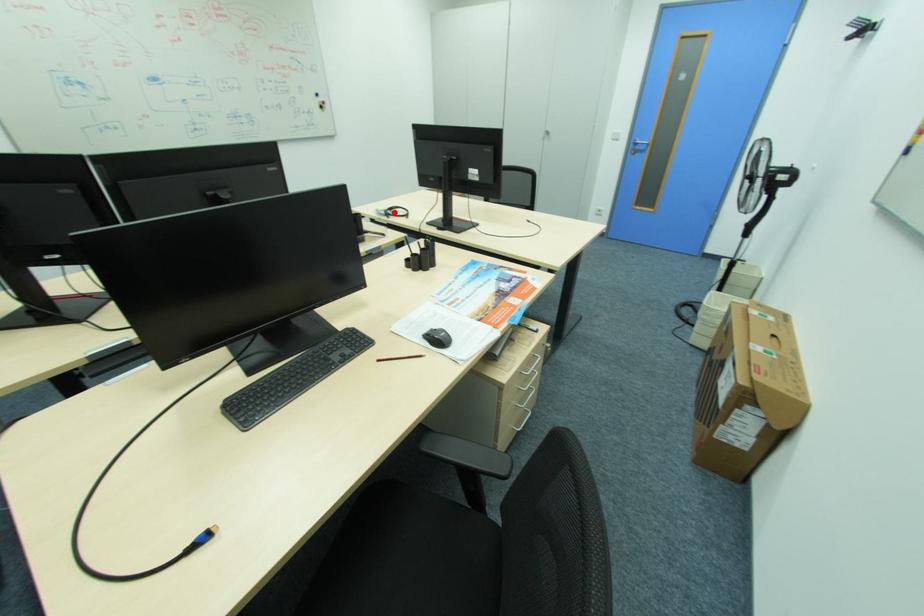
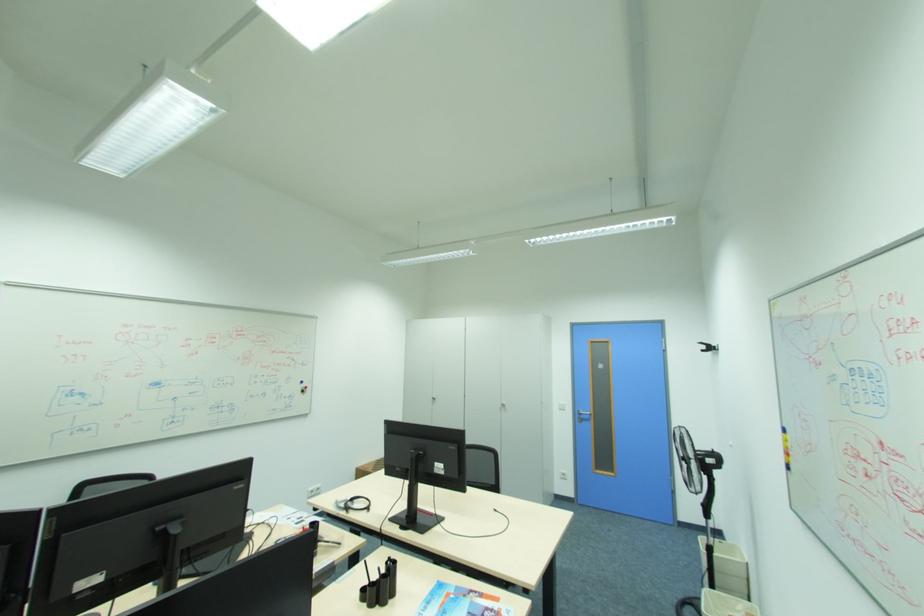
Locate, in the second image, the point that corresponds to the highlighted location in the first image.

(355, 505)